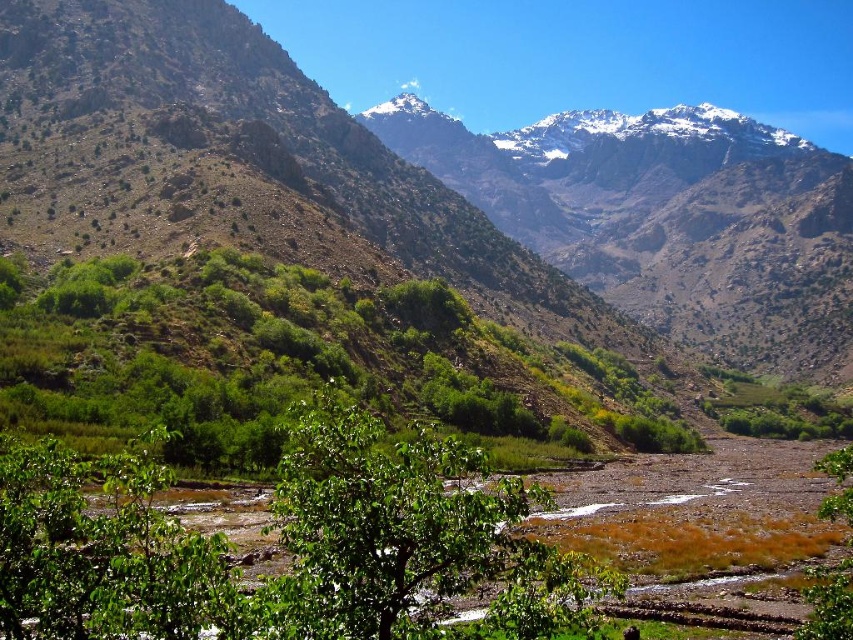
You are a hiker standing at the bottom of the valley and want to reach the green leafy tree at center. Based on the coordinates provided, in which direction should you head to reach the tree?

The green leafy tree at center is located at point 0.566 on the x and 0.352 on the y. Since you are at the bottom of the valley, you should head towards the center of the image to reach the tree.